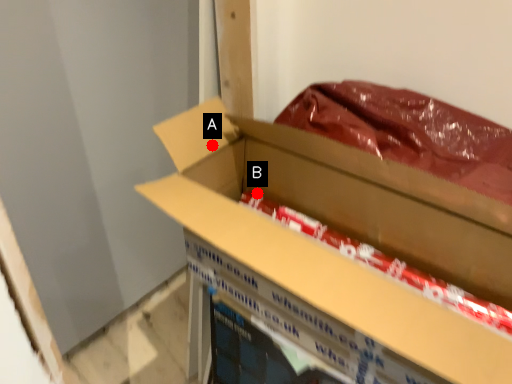
Question: Two points are circled on the image, labeled by A and B beside each circle. Which point is closer to the camera?

Choices:
 (A) A is closer
 (B) B is closer

Answer: (A)